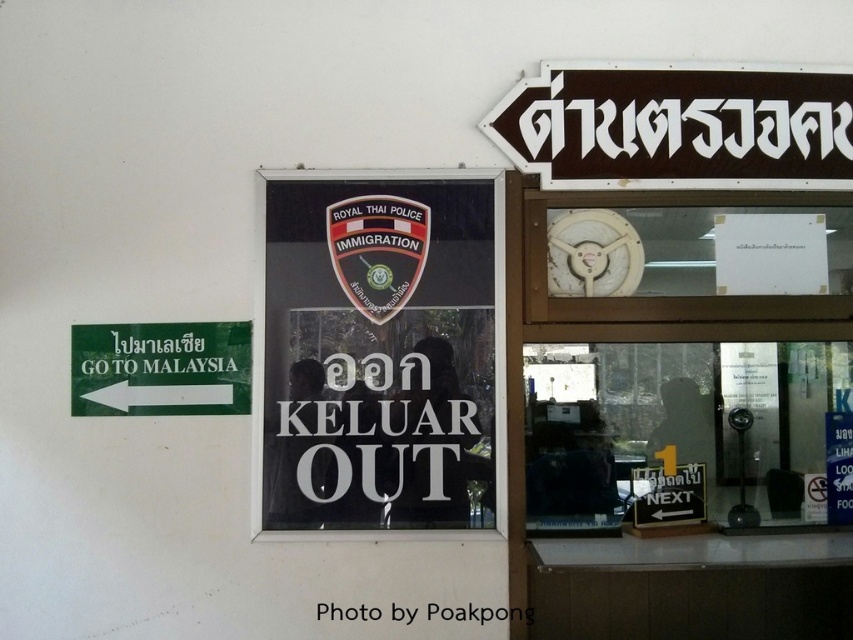
You are at a border crossing between Thailand and Malaysia and need to determine the direction to Malaysia. You see a green matte sign at left and a white paper at upper center. Which object is taller?

The green matte sign at left is taller than the white paper at upper center.

You are standing at the border crossing between Thailand and Malaysia and need to approach the transparent glass window at center to submit your documents. If your arms can reach up to 2 meters, can you reach the window without moving closer?

The transparent glass window at center is 2.74 meters away from the camera. Since your arms can only reach up to 2 meters, you cannot reach the window without moving closer.

You are standing in front of the building shown in the image. You want to find the transparent glass window at center to submit your documents. According to the coordinates provided, where should you look relative to the green sign with white text that says GO TO MALAYSIA?

The transparent glass window at center is located at coordinates point (x=683, y=433). Since the green sign with white text that says GO TO MALAYSIA is on the left side of the image, the transparent glass window at center is to the right of the green sign with white text that says GO TO MALAYSIA.